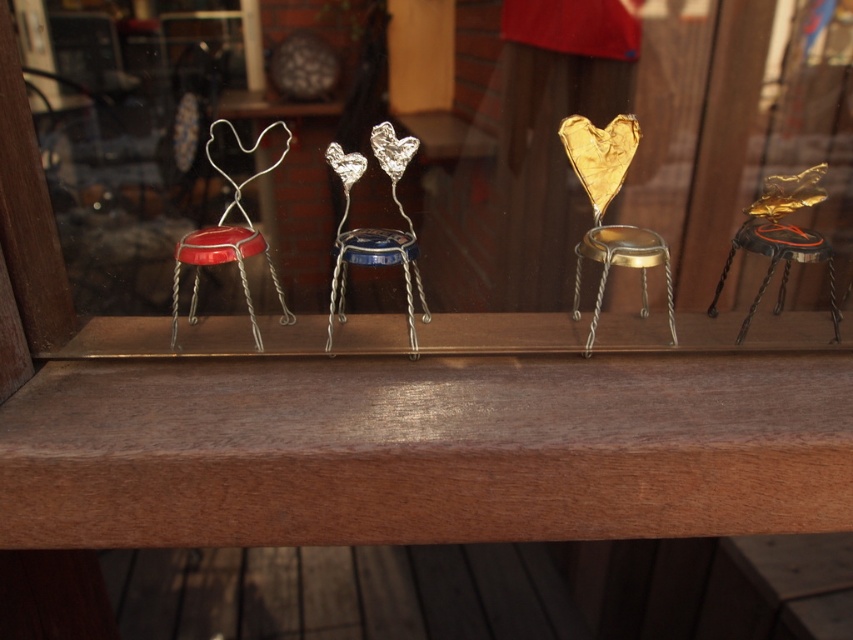
You are an art curator examining the sculptures on the wooden shelf. You notice two stools labeled as metallic wire stools at center and gold metallic stool at center. Which one is closer to you?

The metallic wire stools at center is closer to you since it is in front of the gold metallic stool at center.

You are standing in front of the wooden shelf with the sculptures. Where is the shiny brown wood at center located on the shelf?

The shiny brown wood at center is located at point 0.680 on the x axis and 0.504 on the y axis.

You are an art curator examining the sculptures on the wooden shelf. You notice two stools among them. Which one is positioned to the left between the metallic wire stools at center and the gold metallic stool at center?

The metallic wire stools at center are positioned to the left of the gold metallic stool at center.